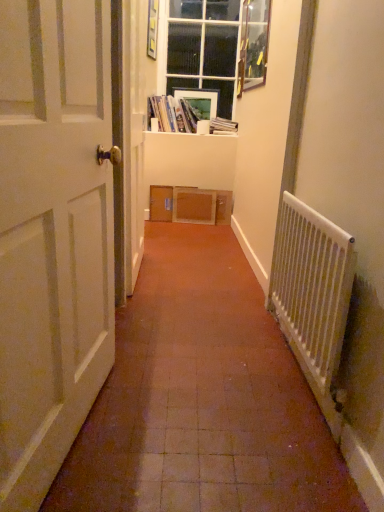
Describe the element at coordinates (224, 134) in the screenshot. I see `white glossy window sill at upper center` at that location.

The width and height of the screenshot is (384, 512). What do you see at coordinates (52, 234) in the screenshot? I see `white matte door at left` at bounding box center [52, 234].

Looking at this image, measure the distance between point (172, 126) and camera.

They are 3.80 meters apart.

Describe the element at coordinates (253, 45) in the screenshot. I see `wooden picture frame at upper right, the first picture frame viewed from the right` at that location.

The height and width of the screenshot is (512, 384). In order to click on clear glass window at upper center in this screenshot , I will do `click(203, 48)`.

Based on the photo, from a real-world perspective, who is located higher, white matte door at left or matte cardboard books at upper center, acting as the 1th book starting from the left?

matte cardboard books at upper center, acting as the 1th book starting from the left, is physically above.

From the image's perspective, who appears lower, white matte door at left or matte cardboard books at upper center, placed as the 2th book when sorted from right to left?

white matte door at left is shown below in the image.

Does white matte door at left have a greater height compared to matte cardboard books at upper center, acting as the 1th book starting from the left?

Yes.

Considering the sizes of objects white matte door at left and hardcover book at upper center, which is the first book in right-to-left order, in the image provided, who is taller, white matte door at left or hardcover book at upper center, which is the first book in right-to-left order,?

Standing taller between the two is white matte door at left.

What are the coordinates of `the 1st book positioned above the white matte door at left (from the image's perspective)` in the screenshot? It's located at (222, 126).

Considering the positions of points (42, 184) and (227, 133), is point (42, 184) farther from camera compared to point (227, 133)?

No.

In the image, is white matte door at left positioned in front of or behind hardcover book at upper center, which is the first book in right-to-left order?

Visually, white matte door at left is located in front of hardcover book at upper center, which is the first book in right-to-left order.

You are a GUI agent. You are given a task and a screenshot of the screen. Output one action in this format:
    pyautogui.click(x=<x>, y=<y>)
    Task: Click on the picture frame on the right of hardcover book at upper center, which appears as the 2th book when viewed from the left
    
    Given the screenshot: What is the action you would take?
    pyautogui.click(x=253, y=45)

From the image's perspective, who appears lower, hardcover book at upper center, which is the first book in right-to-left order, or wooden picture frame at upper right, the first picture frame viewed from the right?

hardcover book at upper center, which is the first book in right-to-left order, from the image's perspective.

Does point (219, 126) appear closer or farther from the camera than point (262, 24)?

Point (219, 126) is farther from the camera than point (262, 24).

Considering the sizes of objects hardcover book at upper center, which is the first book in right-to-left order, and white glossy window sill at upper center in the image provided, who is shorter, hardcover book at upper center, which is the first book in right-to-left order, or white glossy window sill at upper center?

white glossy window sill at upper center is shorter.

The image size is (384, 512). I want to click on book behind the white glossy window sill at upper center, so click(222, 126).

Can you confirm if hardcover book at upper center, which is the first book in right-to-left order, is wider than white glossy window sill at upper center?

No.

Is hardcover book at upper center, which is the first book in right-to-left order, far away from white glossy window sill at upper center?

Actually, hardcover book at upper center, which is the first book in right-to-left order, and white glossy window sill at upper center are a little close together.

Is matte cardboard books at upper center, placed as the 2th book when sorted from right to left, surrounded by hardcover book at upper center, which is the first book in right-to-left order?

No, matte cardboard books at upper center, placed as the 2th book when sorted from right to left, is located outside of hardcover book at upper center, which is the first book in right-to-left order.

Is hardcover book at upper center, which appears as the 2th book when viewed from the left, far from matte cardboard books at upper center, acting as the 1th book starting from the left?

No, hardcover book at upper center, which appears as the 2th book when viewed from the left, is not far away from matte cardboard books at upper center, acting as the 1th book starting from the left.

Is hardcover book at upper center, which appears as the 2th book when viewed from the left, bigger or smaller than matte cardboard books at upper center, acting as the 1th book starting from the left?

In the image, hardcover book at upper center, which appears as the 2th book when viewed from the left, appears to be smaller than matte cardboard books at upper center, acting as the 1th book starting from the left.

From the image's perspective, between hardcover book at upper center, which appears as the 2th book when viewed from the left, and matte cardboard books at upper center, acting as the 1th book starting from the left, who is located below?

hardcover book at upper center, which appears as the 2th book when viewed from the left, is shown below in the image.

Between clear glass window at upper center and white glossy window sill at upper center, which one has larger size?

Bigger between the two is clear glass window at upper center.

Are clear glass window at upper center and white glossy window sill at upper center beside each other?

They are not placed beside each other.

Considering the positions of objects clear glass window at upper center and white glossy window sill at upper center in the image provided, who is more to the right, clear glass window at upper center or white glossy window sill at upper center?

From the viewer's perspective, clear glass window at upper center appears more on the right side.

From the image's perspective, which is below, clear glass window at upper center or white glossy window sill at upper center?

white glossy window sill at upper center, from the image's perspective.

From the image's perspective, is matte cardboard books at upper center, placed as the 2th book when sorted from right to left, on hardcover book at upper center, which appears as the 2th book when viewed from the left?

Yes.

Considering the positions of objects matte cardboard books at upper center, placed as the 2th book when sorted from right to left, and hardcover book at upper center, which appears as the 2th book when viewed from the left, in the image provided, who is more to the left, matte cardboard books at upper center, placed as the 2th book when sorted from right to left, or hardcover book at upper center, which appears as the 2th book when viewed from the left,?

matte cardboard books at upper center, placed as the 2th book when sorted from right to left.

Can you see matte cardboard books at upper center, acting as the 1th book starting from the left, touching hardcover book at upper center, which appears as the 2th book when viewed from the left?

matte cardboard books at upper center, acting as the 1th book starting from the left, and hardcover book at upper center, which appears as the 2th book when viewed from the left, are clearly separated.

Find the location of a particular element. book below the matte cardboard books at upper center, acting as the 1th book starting from the left (from the image's perspective) is located at coordinates (222, 126).

Starting from the white matte door at left, which book is the 1st one to the right? Please provide its 2D coordinates.

[(183, 116)]

Find the location of a particular element. The width and height of the screenshot is (384, 512). book that is the 2nd one when counting backward from the white matte door at left is located at coordinates (222, 126).

Based on their spatial positions, is hardcover book at upper center, which is the first book in right-to-left order, or white matte door at left further from matte plastic picture frame at upper center, arranged as the 2th picture frame when viewed from the front?

Based on the image, white matte door at left appears to be further to matte plastic picture frame at upper center, arranged as the 2th picture frame when viewed from the front.

Based on the photo, estimate the real-world distances between objects in this image. Which object is further from clear glass window at upper center, matte cardboard books at upper center, placed as the 2th book when sorted from right to left, or white glossy window sill at upper center?

Based on the image, white glossy window sill at upper center appears to be further to clear glass window at upper center.

From the image, which object appears to be nearer to hardcover book at upper center, which is the first book in right-to-left order, white matte door at left or matte plastic picture frame at upper center, the 1th picture frame when ordered from back to front?

matte plastic picture frame at upper center, the 1th picture frame when ordered from back to front.

Which object lies nearer to the anchor point matte plastic picture frame at upper center, the 1th picture frame when ordered from back to front, white plastic radiator at right or matte cardboard books at upper center, acting as the 1th book starting from the left?

matte cardboard books at upper center, acting as the 1th book starting from the left.

From the image, which object appears to be nearer to white glossy window sill at upper center, matte plastic picture frame at upper center, the second picture frame in the right-to-left sequence, or white matte door at left?

Based on the image, matte plastic picture frame at upper center, the second picture frame in the right-to-left sequence, appears to be nearer to white glossy window sill at upper center.

Based on their spatial positions, is matte plastic picture frame at upper center, arranged as the 2th picture frame when viewed from the front, or white glossy window sill at upper center closer to wooden picture frame at upper right, the first picture frame from the front?

white glossy window sill at upper center is closer to wooden picture frame at upper right, the first picture frame from the front.

Consider the image. Which object lies nearer to the anchor point clear glass window at upper center, white matte door at left or hardcover book at upper center, which is the first book in right-to-left order?

The object closer to clear glass window at upper center is hardcover book at upper center, which is the first book in right-to-left order.

When comparing their distances from wooden picture frame at upper right, the first picture frame viewed from the right, does white plastic radiator at right or white glossy window sill at upper center seem further?

white plastic radiator at right is further to wooden picture frame at upper right, the first picture frame viewed from the right.

You are a GUI agent. You are given a task and a screenshot of the screen. Output one action in this format:
    pyautogui.click(x=<x>, y=<y>)
    Task: Click on the window between wooden picture frame at upper right, acting as the 2th picture frame starting from the left, and hardcover book at upper center, which is the first book in right-to-left order, in the front-back direction
    
    Given the screenshot: What is the action you would take?
    pyautogui.click(x=203, y=48)

This screenshot has height=512, width=384. What are the coordinates of `window sill between white plastic radiator at right and matte plastic picture frame at upper center, the second picture frame in the right-to-left sequence, in the front-back direction` in the screenshot? It's located at (224, 134).

This screenshot has width=384, height=512. I want to click on book positioned between white plastic radiator at right and clear glass window at upper center from near to far, so click(183, 116).

Image resolution: width=384 pixels, height=512 pixels. I want to click on picture frame between white matte door at left and hardcover book at upper center, which is the first book in right-to-left order, in the front-back direction, so click(x=253, y=45).